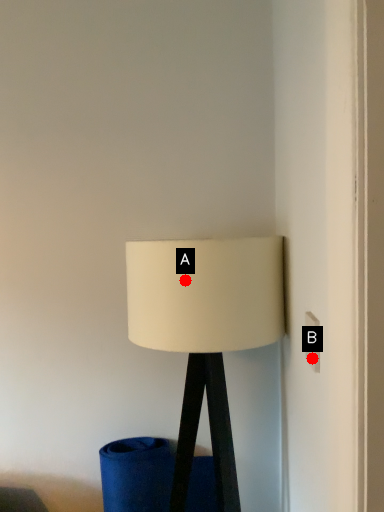
Question: Two points are circled on the image, labeled by A and B beside each circle. Which point is closer to the camera taking this photo?

Choices:
 (A) A is closer
 (B) B is closer

Answer: (B)